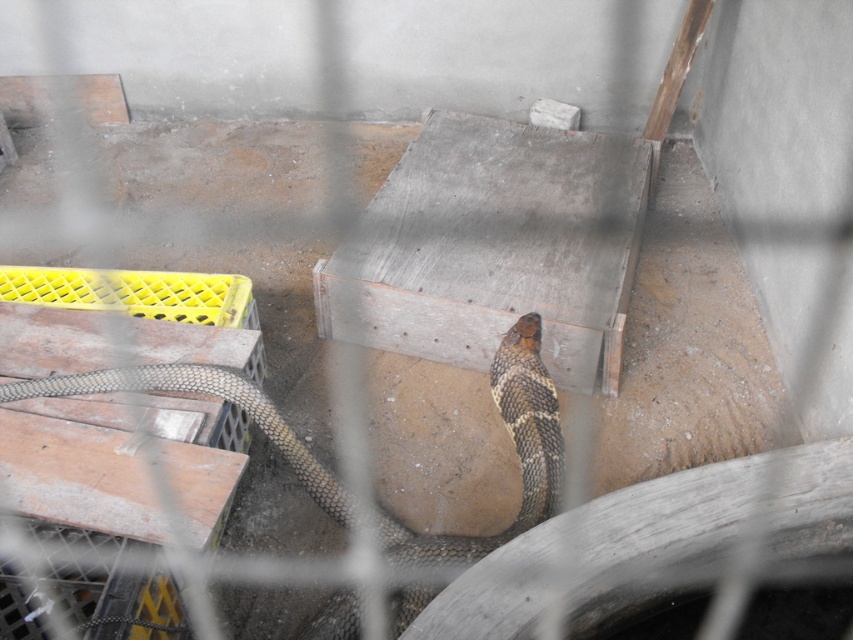
Question: Among these objects, which one is farthest from the camera?

Choices:
 (A) yellow plastic crate at lower left
 (B) brown scaly snake at center

Answer: (B)

Question: Is yellow plastic crate at lower left smaller than brown scaly snake at center?

Choices:
 (A) yes
 (B) no

Answer: (B)

Question: Which point is farther to the camera?

Choices:
 (A) yellow plastic crate at lower left
 (B) brown scaly snake at center

Answer: (B)

Question: Can you confirm if yellow plastic crate at lower left is positioned to the right of brown scaly snake at center?

Choices:
 (A) no
 (B) yes

Answer: (A)

Question: Is yellow plastic crate at lower left thinner than brown scaly snake at center?

Choices:
 (A) yes
 (B) no

Answer: (A)